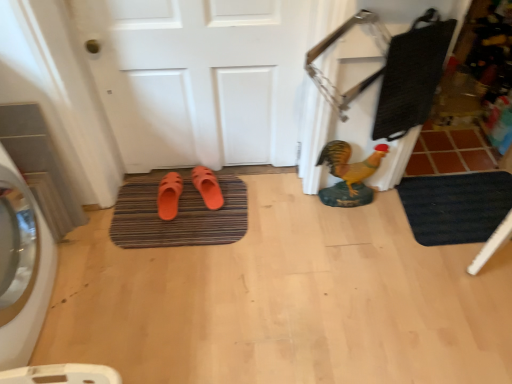
Where is `vacant area that lies between black rubber bath mat at lower right, positioned as the first bath mat in right-to-left order, and brown textured bath mat at center, marked as the first bath mat in a left-to-right arrangement`? The width and height of the screenshot is (512, 384). vacant area that lies between black rubber bath mat at lower right, positioned as the first bath mat in right-to-left order, and brown textured bath mat at center, marked as the first bath mat in a left-to-right arrangement is located at coordinates (317, 218).